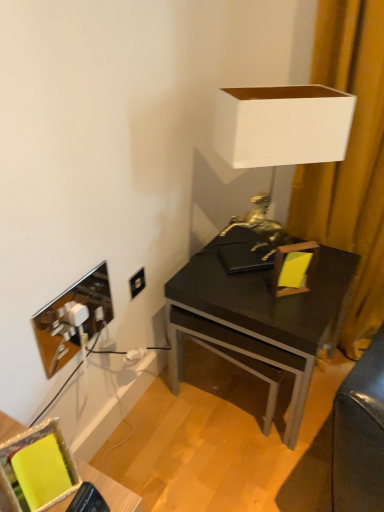
At what (x,y) coordinates should I click in order to perform the action: click on vacant area in front of black matte drawer at center. Please return your answer as a coordinate pair (x, y). Image resolution: width=384 pixels, height=512 pixels. Looking at the image, I should click on (251, 464).